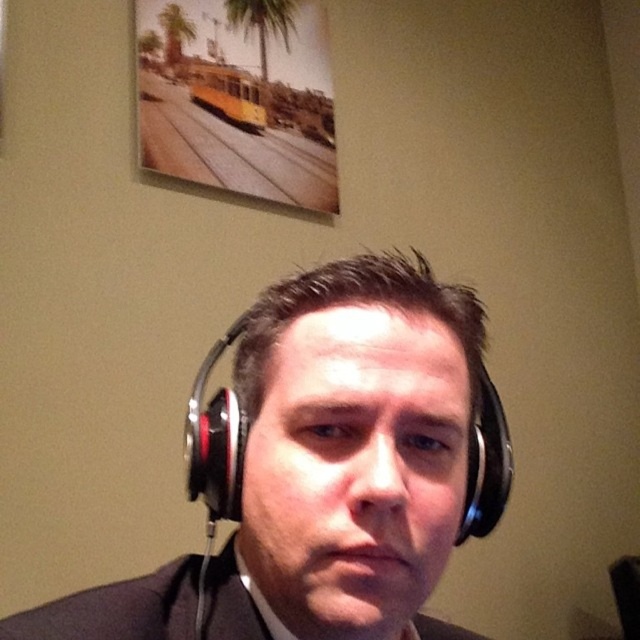
Question: From the image, what is the correct spatial relationship of black matte business suit at lower center in relation to black matte headphones at center?

Choices:
 (A) left
 (B) right

Answer: (A)

Question: Does black matte business suit at lower center appear on the right side of black matte headphones at center?

Choices:
 (A) yes
 (B) no

Answer: (B)

Question: Is the position of black matte business suit at lower center more distant than that of black matte headphones at center?

Choices:
 (A) yes
 (B) no

Answer: (B)

Question: Which object appears farthest from the camera in this image?

Choices:
 (A) black matte business suit at lower center
 (B) black matte headphones at center

Answer: (B)

Question: Which of the following is the closest to the observer?

Choices:
 (A) black matte business suit at lower center
 (B) black matte headphones at center

Answer: (A)